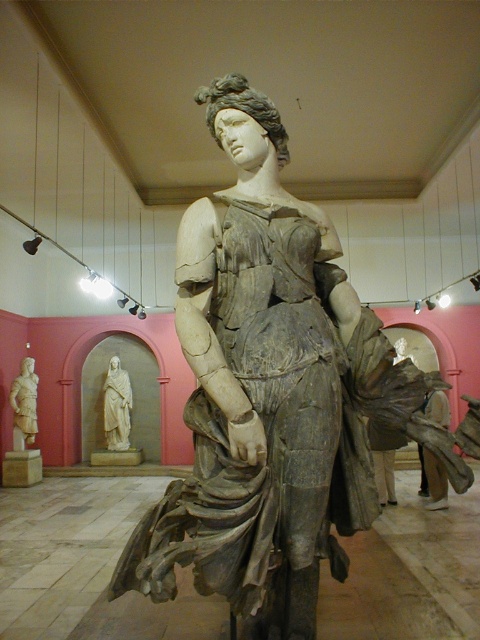
Can you confirm if white marble statue at center is thinner than light beige marble statue at left?

No.

Which is behind, point (130, 388) or point (16, 401)?

Point (130, 388)

Between point (118, 397) and point (20, 390), which one is positioned in front?

Point (20, 390) is more forward.

Where is `white marble statue at center`? white marble statue at center is located at coordinates (117, 406).

Does gray stone statue at center come behind light beige marble statue at left?

No, it is not.

Can you confirm if gray stone statue at center is positioned to the right of light beige marble statue at left?

Yes, gray stone statue at center is to the right of light beige marble statue at left.

Who is more forward, (342, 509) or (26, 369)?

Point (342, 509) is in front.

Locate an element on the screen. This screenshot has width=480, height=640. gray stone statue at center is located at coordinates (271, 394).

Which is behind, point (273, 566) or point (124, 404)?

Positioned behind is point (124, 404).

Does gray stone statue at center appear on the left side of white marble statue at center?

In fact, gray stone statue at center is to the right of white marble statue at center.

Is point (255, 216) closer to viewer compared to point (111, 364)?

That is True.

At what (x,y) coordinates should I click in order to perform the action: click on gray stone statue at center. Please return your answer as a coordinate pair (x, y). Looking at the image, I should click on (271, 394).